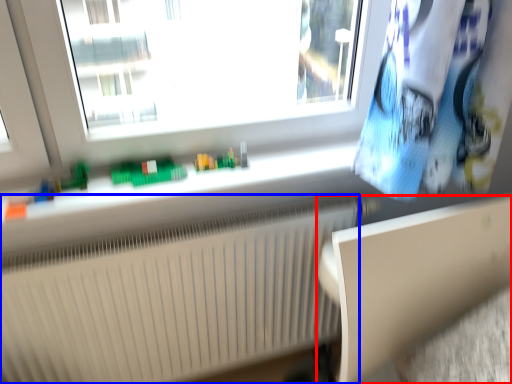
Question: Which of the following is the farthest to the observer, table (highlighted by a red box) or radiator (highlighted by a blue box)?

Choices:
 (A) table
 (B) radiator

Answer: (B)